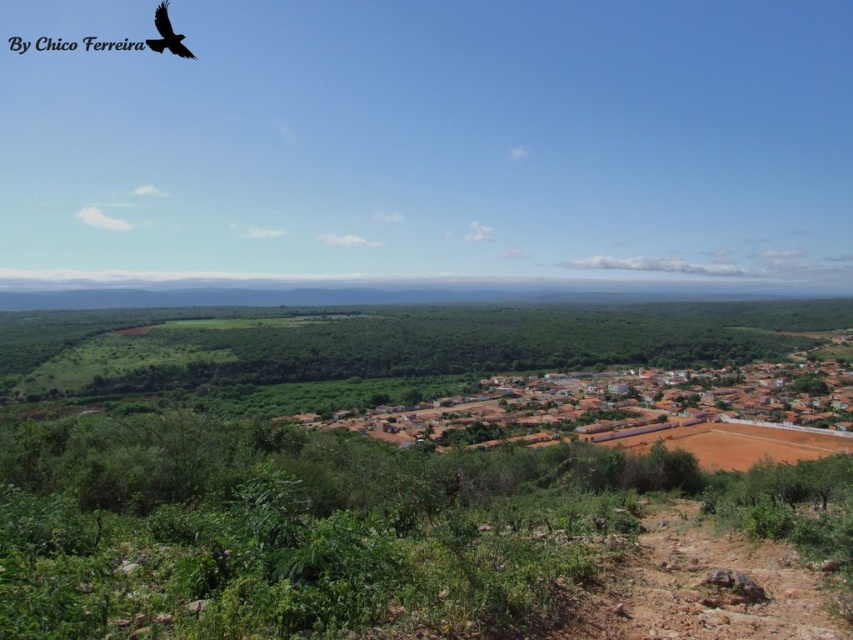
Looking at this image, can you confirm if brown clay houses at center is thinner than black feathered bird at upper left?

Incorrect, brown clay houses at center's width is not less than black feathered bird at upper left's.

Between brown clay houses at center and black feathered bird at upper left, which one appears on the right side from the viewer's perspective?

brown clay houses at center is more to the right.

Where is `brown clay houses at center`? This screenshot has width=853, height=640. brown clay houses at center is located at coordinates (624, 404).